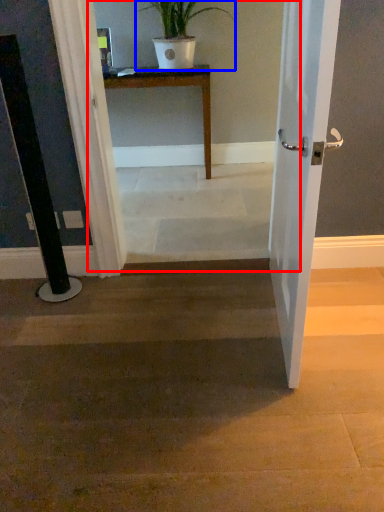
Question: Among these objects, which one is nearest to the camera, corridor (highlighted by a red box) or houseplant (highlighted by a blue box)?

Choices:
 (A) corridor
 (B) houseplant

Answer: (A)